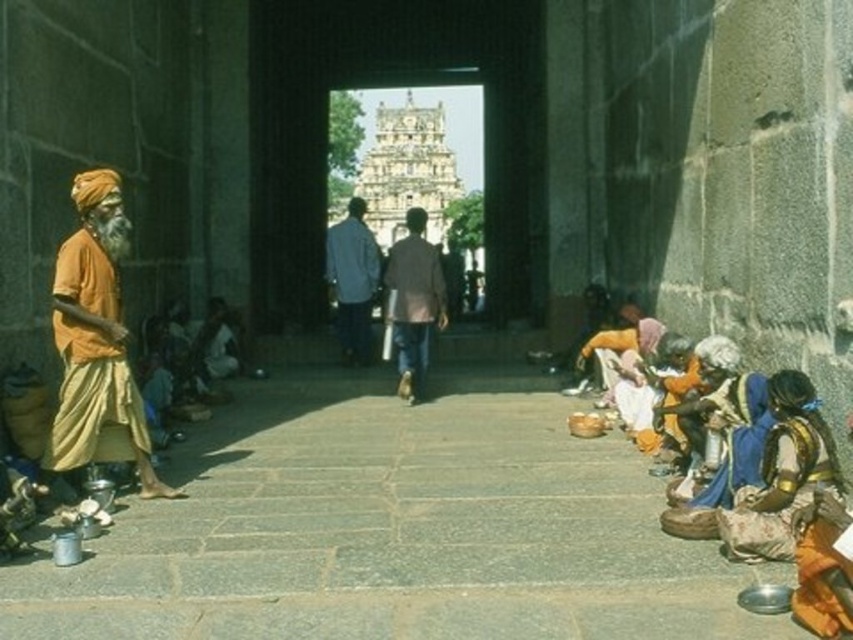
Question: Is orange cotton turban at left bigger than light blue shirt at center?

Choices:
 (A) no
 (B) yes

Answer: (A)

Question: Does orange cotton turban at left come behind brown fabric jacket at center?

Choices:
 (A) no
 (B) yes

Answer: (A)

Question: Which point appears closest to the camera in this image?

Choices:
 (A) (343, 252)
 (B) (422, 250)
 (C) (73, 196)

Answer: (C)

Question: Can you confirm if orange cotton turban at left is thinner than light blue shirt at center?

Choices:
 (A) yes
 (B) no

Answer: (B)

Question: Which point appears farthest from the camera in this image?

Choices:
 (A) (415, 400)
 (B) (113, 348)

Answer: (A)

Question: Estimate the real-world distances between objects in this image. Which object is closer to the brown fabric jacket at center?

Choices:
 (A) orange cotton turban at left
 (B) light blue shirt at center

Answer: (B)